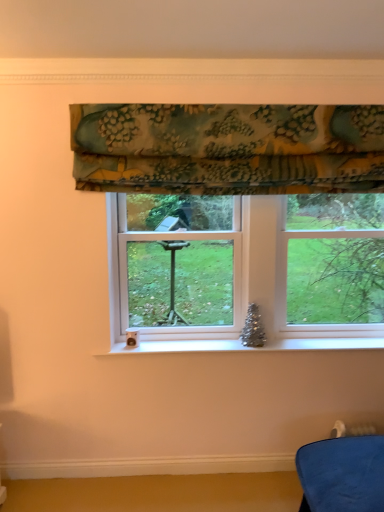
Question: In terms of height, does floral fabric valance at upper center look taller or shorter compared to clear glass window at center?

Choices:
 (A) short
 (B) tall

Answer: (A)

Question: Relative to clear glass window at center, is floral fabric valance at upper center in front or behind?

Choices:
 (A) front
 (B) behind

Answer: (A)

Question: Would you say floral fabric valance at upper center is to the left or to the right of clear glass window at center in the picture?

Choices:
 (A) right
 (B) left

Answer: (B)

Question: Is clear glass window at center inside or outside of floral fabric valance at upper center?

Choices:
 (A) outside
 (B) inside

Answer: (A)

Question: From a real-world perspective, is clear glass window at center physically located above or below floral fabric valance at upper center?

Choices:
 (A) below
 (B) above

Answer: (A)

Question: Considering the positions of clear glass window at center and floral fabric valance at upper center in the image, is clear glass window at center taller or shorter than floral fabric valance at upper center?

Choices:
 (A) tall
 (B) short

Answer: (A)

Question: From the image's perspective, relative to floral fabric valance at upper center, is clear glass window at center above or below?

Choices:
 (A) above
 (B) below

Answer: (B)